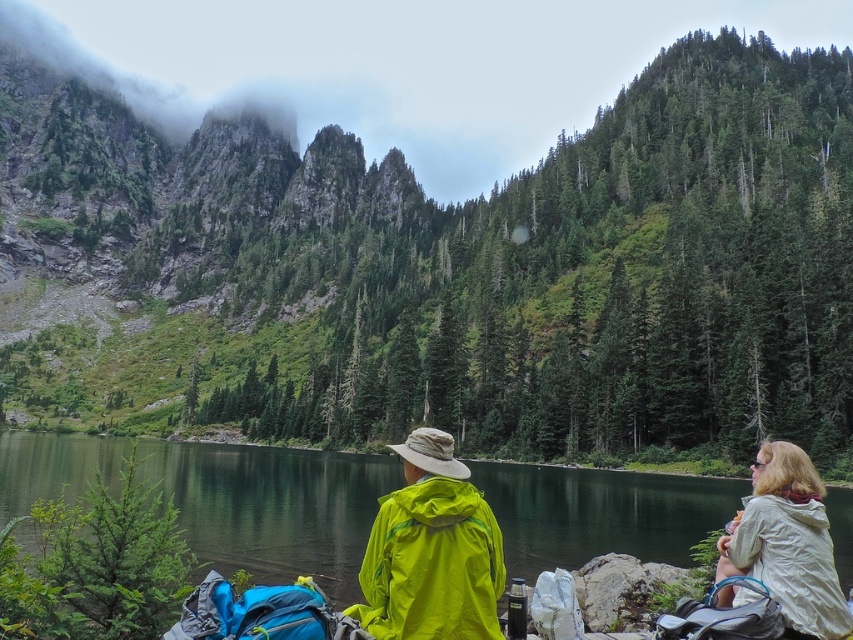
Question: Is green forested mountain at center smaller than green matte water at center?

Choices:
 (A) no
 (B) yes

Answer: (A)

Question: Does green forested mountain at center appear over green matte water at center?

Choices:
 (A) yes
 (B) no

Answer: (A)

Question: Can you confirm if green forested mountain at center is thinner than light beige jacket at lower right?

Choices:
 (A) yes
 (B) no

Answer: (B)

Question: Which is nearer to the green forested mountain at center?

Choices:
 (A) green matte water at center
 (B) light beige jacket at lower right

Answer: (A)

Question: Which object appears closest to the camera in this image?

Choices:
 (A) green forested mountain at center
 (B) light beige jacket at lower right

Answer: (B)

Question: Which of the following is the farthest from the observer?

Choices:
 (A) green forested mountain at center
 (B) green matte water at center
 (C) light beige jacket at lower right

Answer: (A)